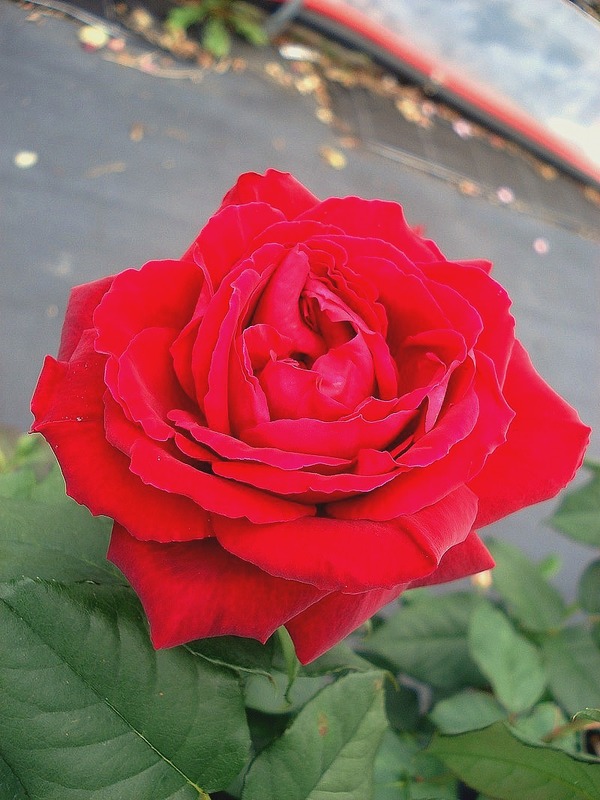
I want to click on trim, so click(x=459, y=109), click(x=466, y=100).